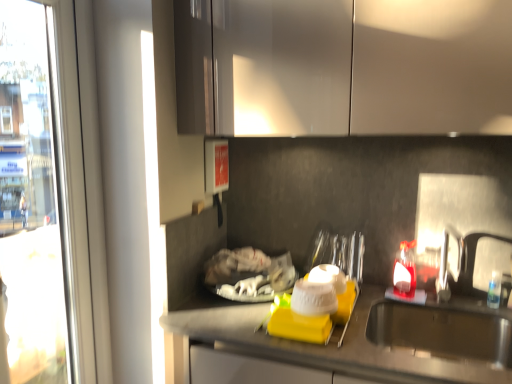
Question: Considering the relative sizes of glossy white cabinets at upper center and stainless steel sink at lower right in the image provided, is glossy white cabinets at upper center wider than stainless steel sink at lower right?

Choices:
 (A) yes
 (B) no

Answer: (B)

Question: Can you confirm if glossy white cabinets at upper center is thinner than stainless steel sink at lower right?

Choices:
 (A) yes
 (B) no

Answer: (A)

Question: From a real-world perspective, is glossy white cabinets at upper center on stainless steel sink at lower right?

Choices:
 (A) no
 (B) yes

Answer: (B)

Question: Could you tell me if glossy white cabinets at upper center is facing stainless steel sink at lower right?

Choices:
 (A) yes
 (B) no

Answer: (B)

Question: Is glossy white cabinets at upper center facing away from stainless steel sink at lower right?

Choices:
 (A) yes
 (B) no

Answer: (B)

Question: Do you think transparent glass window at left is within stainless steel sink at lower right, or outside of it?

Choices:
 (A) inside
 (B) outside

Answer: (B)

Question: From the image's perspective, is transparent glass window at left positioned above or below stainless steel sink at lower right?

Choices:
 (A) below
 (B) above

Answer: (B)

Question: Considering the positions of transparent glass window at left and stainless steel sink at lower right in the image, is transparent glass window at left bigger or smaller than stainless steel sink at lower right?

Choices:
 (A) big
 (B) small

Answer: (A)

Question: Is transparent glass window at left in front of or behind stainless steel sink at lower right in the image?

Choices:
 (A) front
 (B) behind

Answer: (A)

Question: Is glossy white cabinets at upper center inside the boundaries of transparent glass window at left, or outside?

Choices:
 (A) outside
 (B) inside

Answer: (A)

Question: Is point (440, 29) closer or farther from the camera than point (59, 71)?

Choices:
 (A) farther
 (B) closer

Answer: (B)

Question: From the image's perspective, is glossy white cabinets at upper center positioned above or below transparent glass window at left?

Choices:
 (A) below
 (B) above

Answer: (B)

Question: Looking at their shapes, would you say glossy white cabinets at upper center is wider or thinner than transparent glass window at left?

Choices:
 (A) thin
 (B) wide

Answer: (B)

Question: Is point (438, 349) closer or farther from the camera than point (320, 67)?

Choices:
 (A) closer
 (B) farther

Answer: (B)

Question: From the image's perspective, relative to glossy white cabinets at upper center, is stainless steel sink at lower right above or below?

Choices:
 (A) above
 (B) below

Answer: (B)